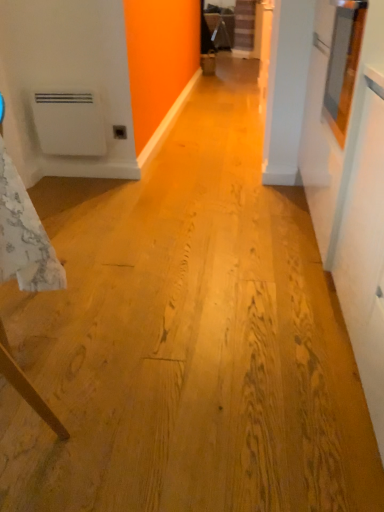
Question: Can you confirm if white matte water heater at left is smaller than white textured tablecloth at left?

Choices:
 (A) no
 (B) yes

Answer: (B)

Question: Could you tell me if white matte water heater at left is facing white textured tablecloth at left?

Choices:
 (A) yes
 (B) no

Answer: (A)

Question: From the image's perspective, would you say white matte water heater at left is positioned over white textured tablecloth at left?

Choices:
 (A) yes
 (B) no

Answer: (A)

Question: Can you confirm if white matte water heater at left is bigger than white textured tablecloth at left?

Choices:
 (A) no
 (B) yes

Answer: (A)

Question: From a real-world perspective, is white matte water heater at left positioned under white textured tablecloth at left based on gravity?

Choices:
 (A) yes
 (B) no

Answer: (A)

Question: Is white textured tablecloth at left at the back of white matte water heater at left?

Choices:
 (A) no
 (B) yes

Answer: (A)

Question: Does white textured tablecloth at left have a larger size compared to white matte water heater at left?

Choices:
 (A) yes
 (B) no

Answer: (A)

Question: Is white textured tablecloth at left thinner than white matte water heater at left?

Choices:
 (A) yes
 (B) no

Answer: (B)

Question: Does white textured tablecloth at left have a greater height compared to white matte water heater at left?

Choices:
 (A) yes
 (B) no

Answer: (A)

Question: Is white textured tablecloth at left to the left of white matte water heater at left from the viewer's perspective?

Choices:
 (A) no
 (B) yes

Answer: (A)

Question: Can you confirm if white textured tablecloth at left is wider than white matte water heater at left?

Choices:
 (A) no
 (B) yes

Answer: (B)

Question: Is white textured tablecloth at left smaller than white matte water heater at left?

Choices:
 (A) yes
 (B) no

Answer: (B)

Question: From a real-world perspective, is white matte water heater at left located beneath matte plastic outlet at center?

Choices:
 (A) yes
 (B) no

Answer: (B)